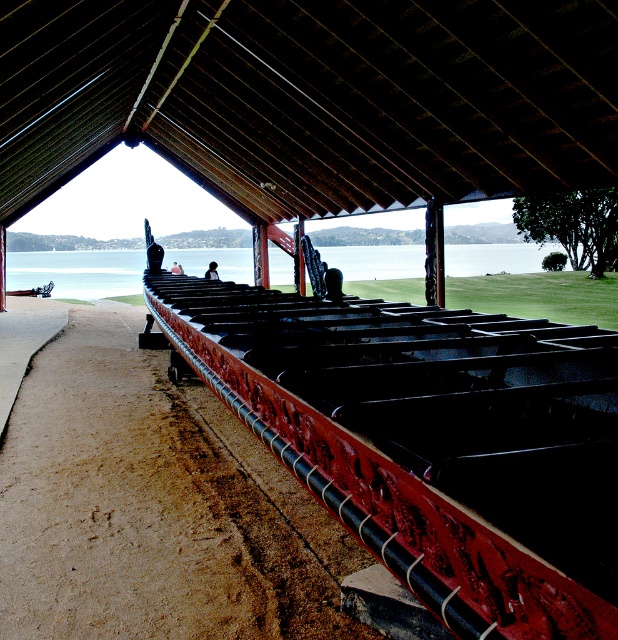
You are standing at the water edge and want to walk back to the parking lot. The parking lot is behind the brown sandy dirt track at lower left. Can you walk directly from the clear water at center to the parking lot without crossing the track?

The brown sandy dirt track at lower left is in front of clear water at center, meaning the track is between you and the parking lot. To reach the parking lot, you must cross the track from the clear water at center.

Looking at this image, you are standing at the water edge and want to walk to the rustic wood canoe at center. There is a light brown wooden person at center blocking your path. Can you walk around them to reach the canoe?

The rustic wood canoe at center and light brown wooden person at center are 15.46 meters apart from each other, so you can walk around the light brown wooden person at center to reach the rustic wood canoe at center since there is enough space between them.

You are standing at the bottom of the brown sandy dirt track at lower left and want to reach the clear water at center. Which direction should you move to go uphill?

The brown sandy dirt track at lower left has a lesser height compared to clear water at center, so you should move towards the clear water at center to go uphill.